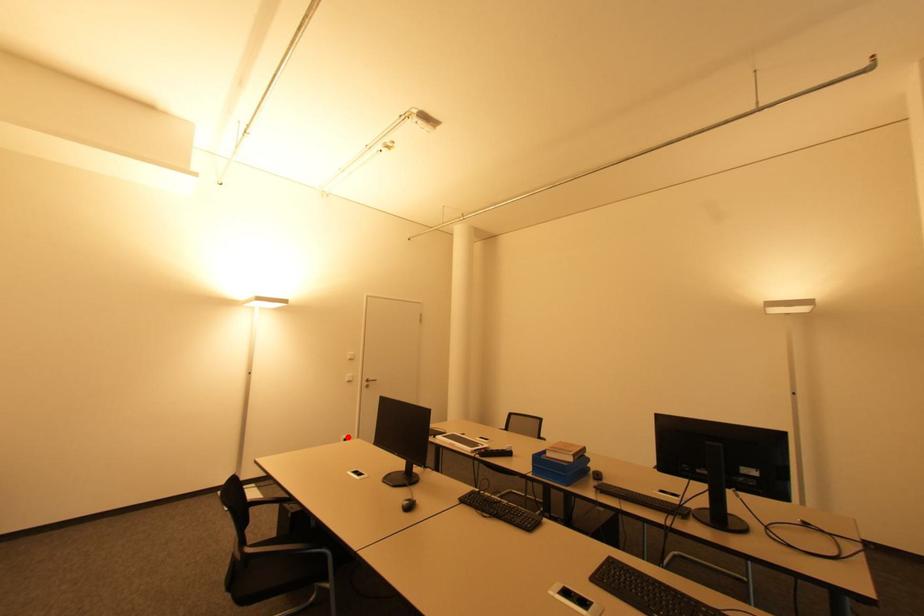
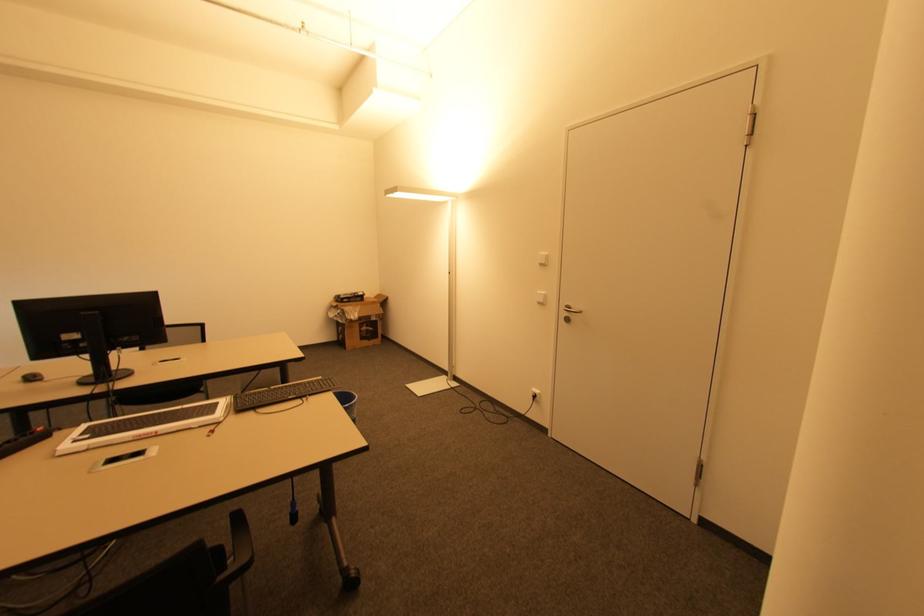
Find the pixel in the second image that matches the highlighted location in the first image.

(539, 392)